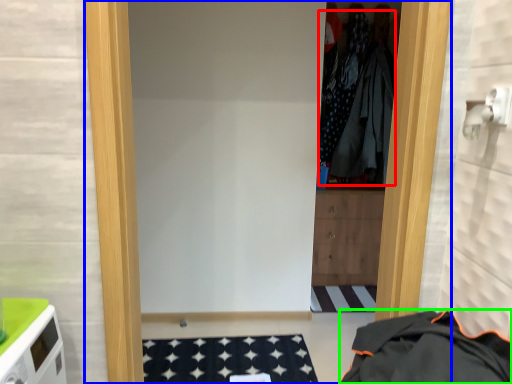
Question: Which object is positioned closest to clothing (highlighted by a red box)? Select from door (highlighted by a blue box) and clothing (highlighted by a green box).

Choices:
 (A) door
 (B) clothing

Answer: (B)